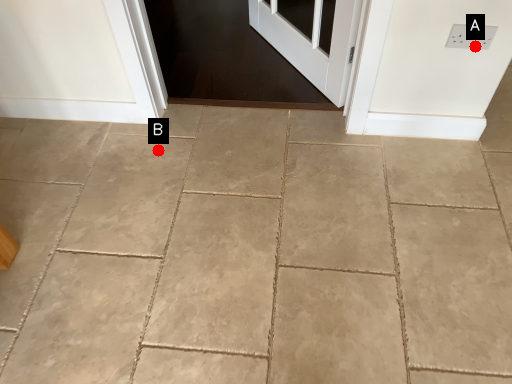
Question: Two points are circled on the image, labeled by A and B beside each circle. Among these points, which one is nearest to the camera?

Choices:
 (A) A is closer
 (B) B is closer

Answer: (A)